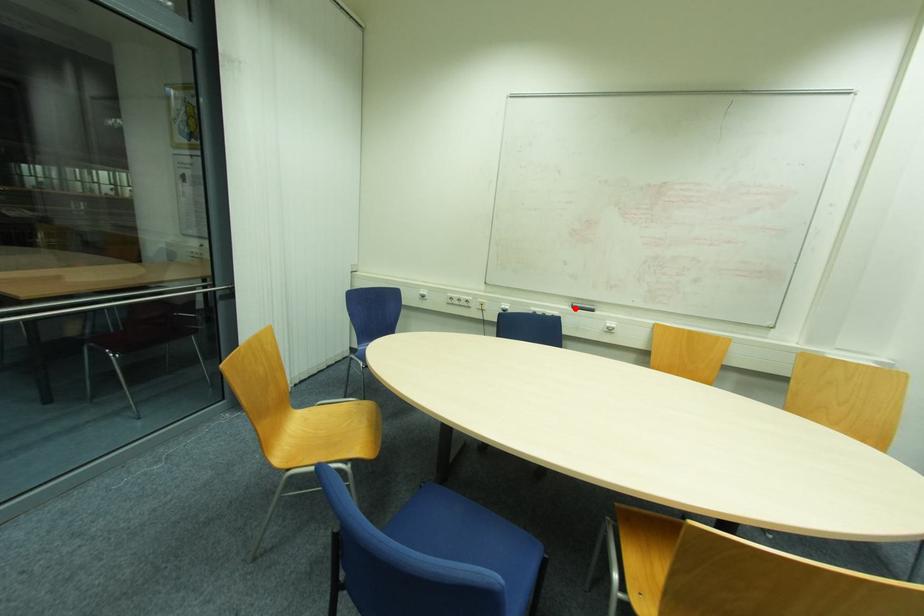
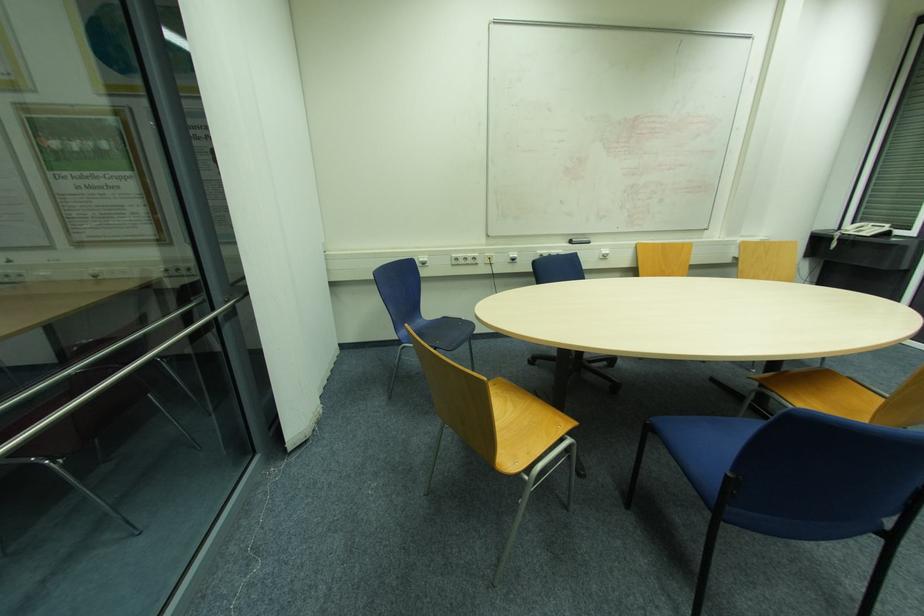
Question: I am providing you with two images of the same scene from different viewpoints. A red point is shown in image1. For the corresponding object point in image2, is it positioned nearer or farther from the camera?

Choices:
 (A) Nearer
 (B) Farther

Answer: (B)